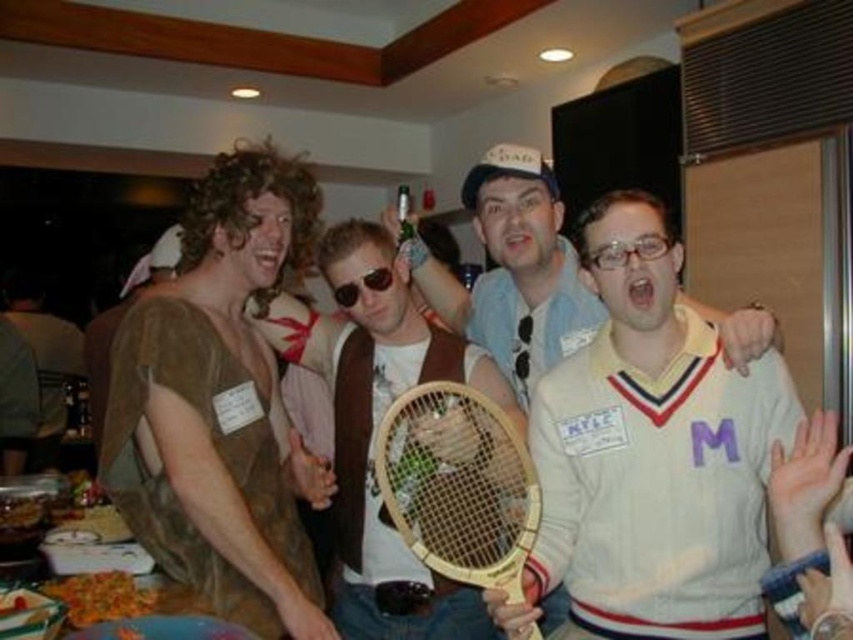
Consider the image. You are standing 1.5 meters away from the camera. You want to take a photo of the white jersey at center. Can you reach it without moving closer?

The white jersey at center is 1.04 meters from the camera. Since you are 1.5 meters away, you can reach it without moving closer by extending your arm or using a zoom lens.

You are standing at the point marked as point (630, 611) and want to walk to the other side of the room. There is a narrow doorway that is 1.5 meters wide. Can you pass through it without touching the sides?

The distance between the two people is 1.41 meters, so the doorway is 1.5 meters wide. Since the doorway is wider than the distance between the people, you can pass through it without touching the sides.

You are at a party and want to grab a drink from the clear plastic glasses at center without touching the wooden racket at center. Is there enough space between them for you to reach the glasses?

The wooden racket at center is 18.65 inches away from clear plastic glasses at center, so yes, there is enough space between them for you to reach the glasses without touching the racket.